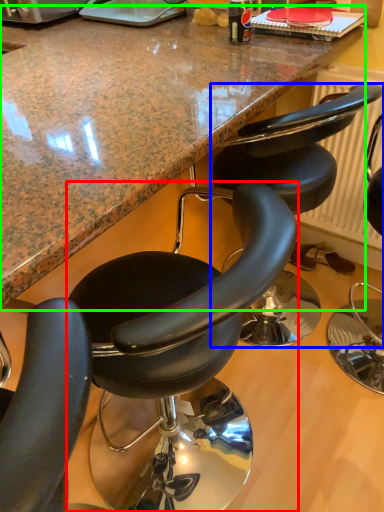
Question: Which object is positioned farthest from chair (highlighted by a red box)? Select from chair (highlighted by a blue box) and countertop (highlighted by a green box).

Choices:
 (A) chair
 (B) countertop

Answer: (B)